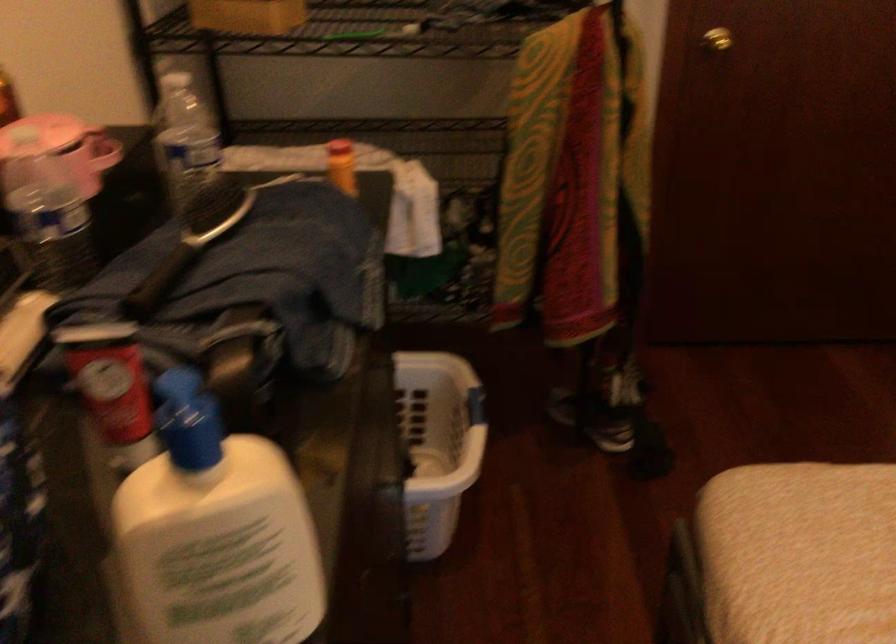
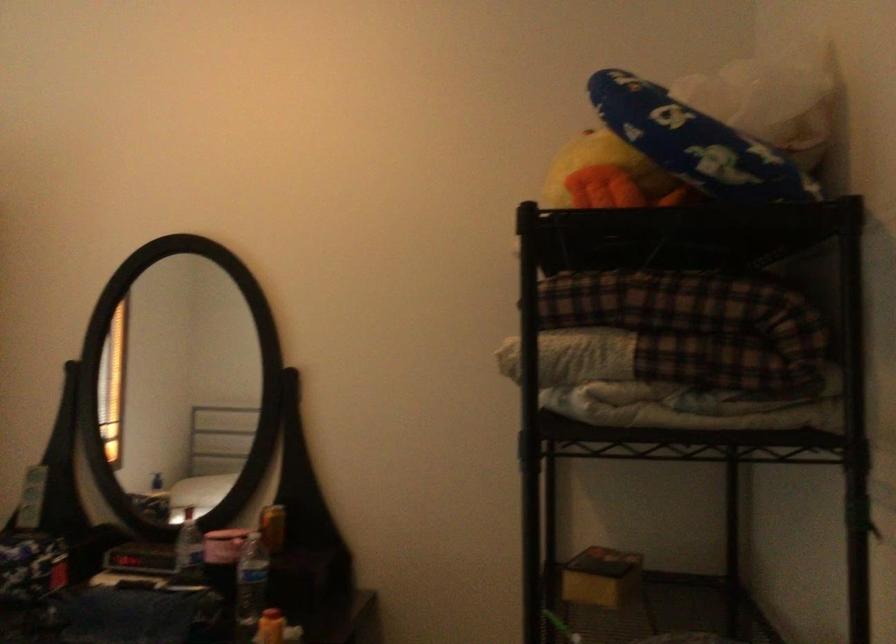
Locate, in the second image, the point that corresponds to the point at 210,167 in the first image.

(250, 585)